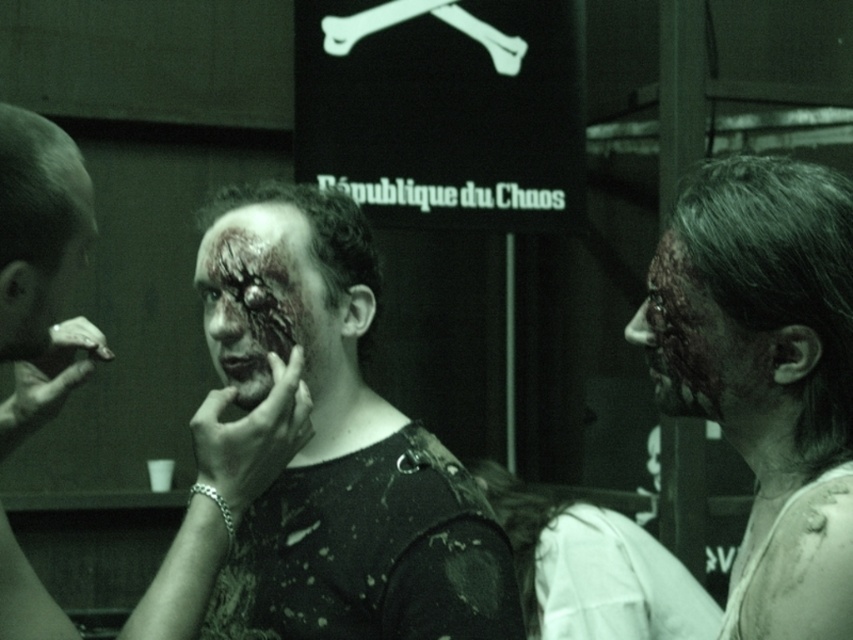
Question: Which object is closer to the camera taking this photo?

Choices:
 (A) grungy textured face at right
 (B) matte black face paint at right
 (C) matte black face at left

Answer: (B)

Question: Which of these objects is positioned closest to the matte black face paint at center?

Choices:
 (A) matte black face at left
 (B) matte black face paint at right
 (C) shiny silver ring at left

Answer: (C)

Question: Is matte black face paint at right further to camera compared to matte black face paint at center?

Choices:
 (A) yes
 (B) no

Answer: (B)

Question: In this image, where is grungy textured face at right located relative to matte black face at left?

Choices:
 (A) above
 (B) below

Answer: (B)

Question: Which object is closer to the camera taking this photo?

Choices:
 (A) grungy painted face at center
 (B) matte black shirt at center
 (C) grungy textured face at right
 (D) shiny silver ring at left

Answer: (D)

Question: Is matte black face paint at right in front of matte black face paint at center?

Choices:
 (A) yes
 (B) no

Answer: (A)